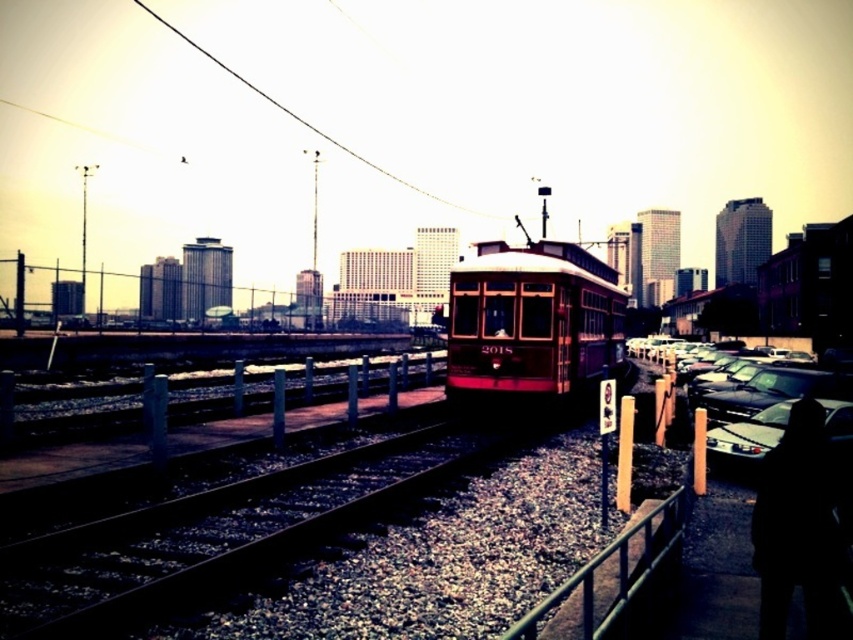
You are standing at the corner of the parking lot and want to locate the shiny red trolley at center. According to the coordinates provided, in which direction should you walk to reach it?

The coordinates of the shiny red trolley at center are at point (532, 321). Since the x and y values are both above 0.5, you should walk towards the northeast direction to reach it.